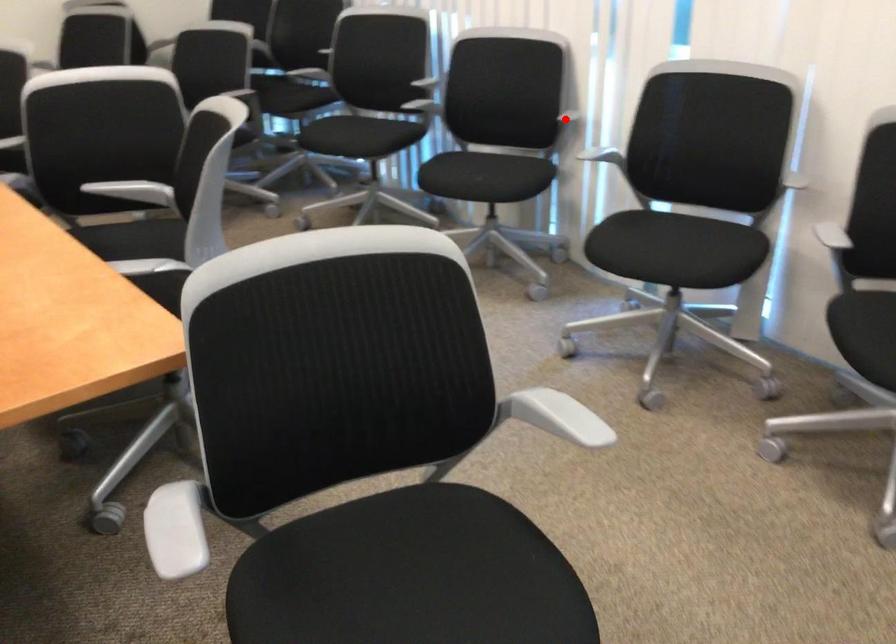
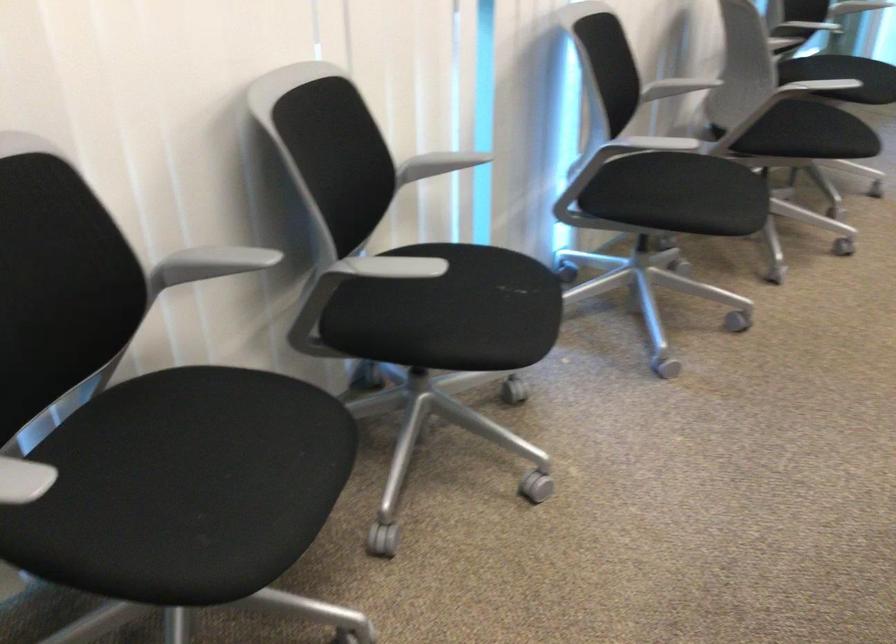
The point at the highlighted location is marked in the first image. Where is the corresponding point in the second image?

(438, 164)